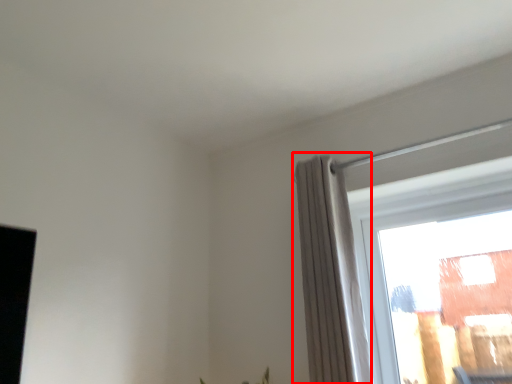
Question: Observing the image, what is the correct spatial positioning of curtain (annotated by the red box) in reference to window?

Choices:
 (A) right
 (B) left

Answer: (B)